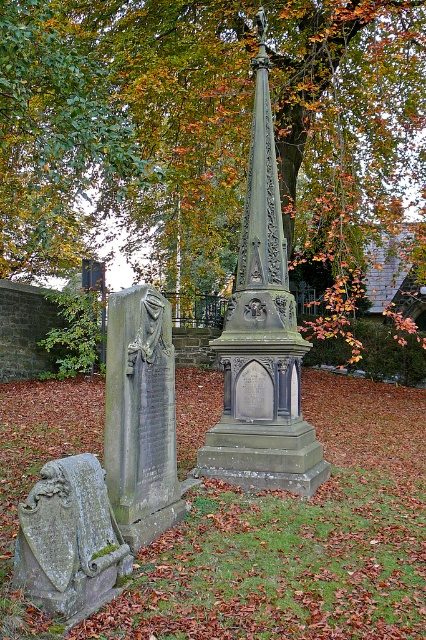
Is dark gray stone monument at center wider than green mossy stone plaque at lower left?

Yes.

Does dark gray stone monument at center have a greater height compared to green mossy stone plaque at lower left?

Yes, dark gray stone monument at center is taller than green mossy stone plaque at lower left.

Locate an element on the screen. The height and width of the screenshot is (640, 426). dark gray stone monument at center is located at coordinates (261, 339).

Image resolution: width=426 pixels, height=640 pixels. Find the location of `dark gray stone monument at center`. dark gray stone monument at center is located at coordinates (261, 339).

Is gray stone gravestone at left above green mossy stone plaque at lower left?

Indeed, gray stone gravestone at left is positioned over green mossy stone plaque at lower left.

Does gray stone gravestone at left have a greater width compared to green mossy stone plaque at lower left?

In fact, gray stone gravestone at left might be narrower than green mossy stone plaque at lower left.

This screenshot has width=426, height=640. Describe the element at coordinates (141, 416) in the screenshot. I see `gray stone gravestone at left` at that location.

The width and height of the screenshot is (426, 640). In order to click on gray stone gravestone at left in this screenshot , I will do `click(141, 416)`.

Does dark gray stone monument at center appear on the left side of gray stone gravestone at left?

No, dark gray stone monument at center is not to the left of gray stone gravestone at left.

Between point (227, 323) and point (115, 438), which one is positioned in front?

Point (115, 438)

This screenshot has height=640, width=426. Identify the location of dark gray stone monument at center. (261, 339).